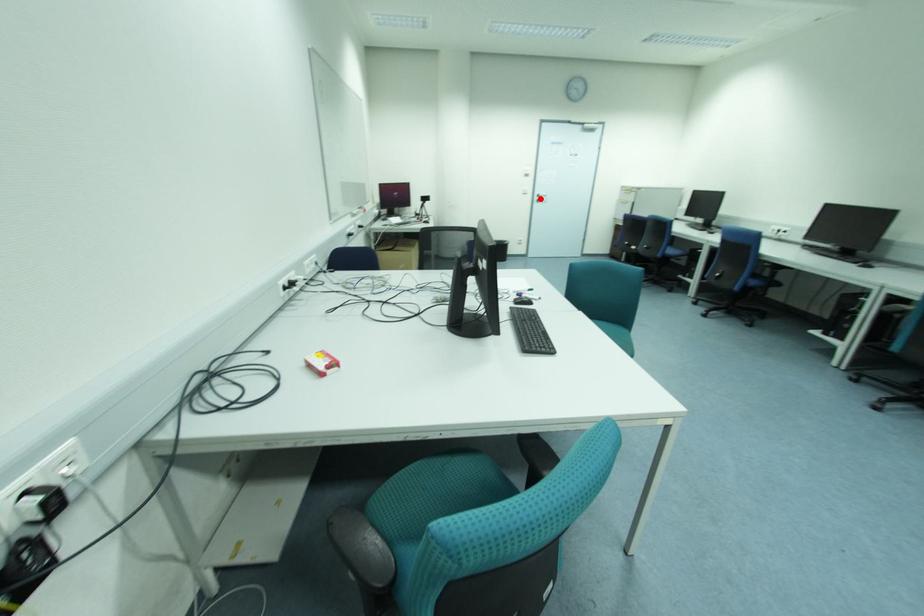
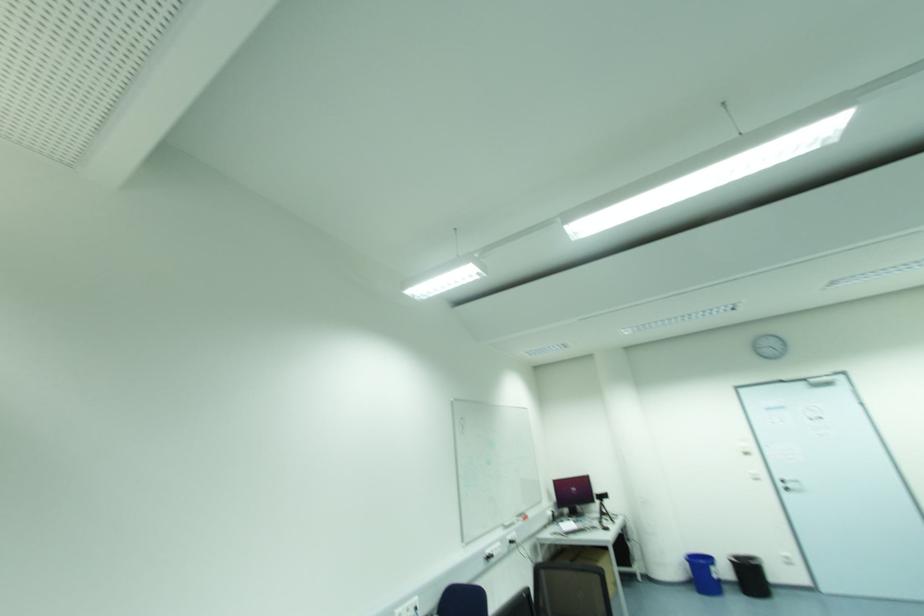
Locate, in the second image, the point that corresponds to the highlighted location in the first image.

(789, 485)